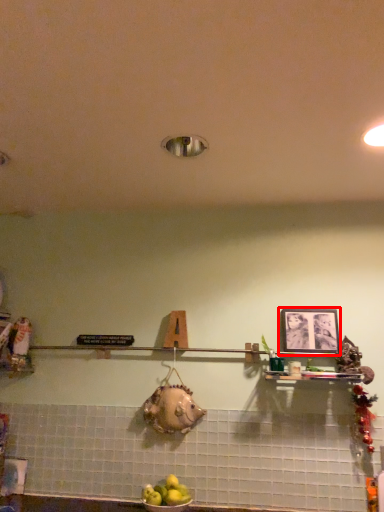
Question: From the image's perspective, what is the correct spatial positioning of picture frame (annotated by the red box) in reference to apple?

Choices:
 (A) above
 (B) below

Answer: (A)